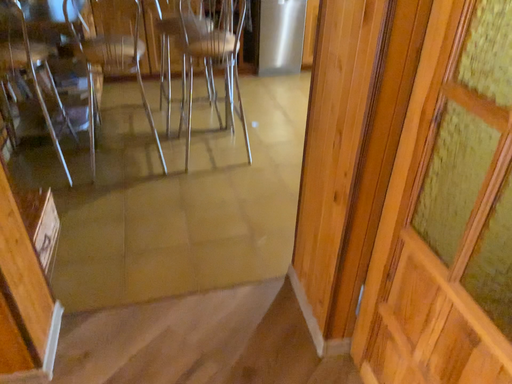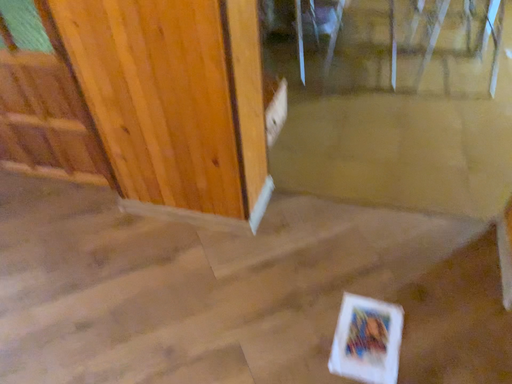
Question: Which way did the camera rotate in the video?

Choices:
 (A) rotated left
 (B) rotated right

Answer: (A)